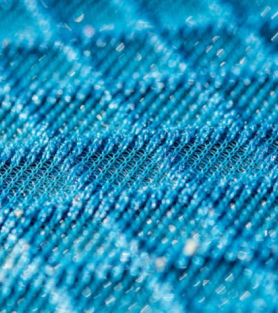
Where is `fabric seams`? The width and height of the screenshot is (278, 313). fabric seams is located at coordinates (129, 111), (177, 171), (204, 197), (100, 199), (180, 191).